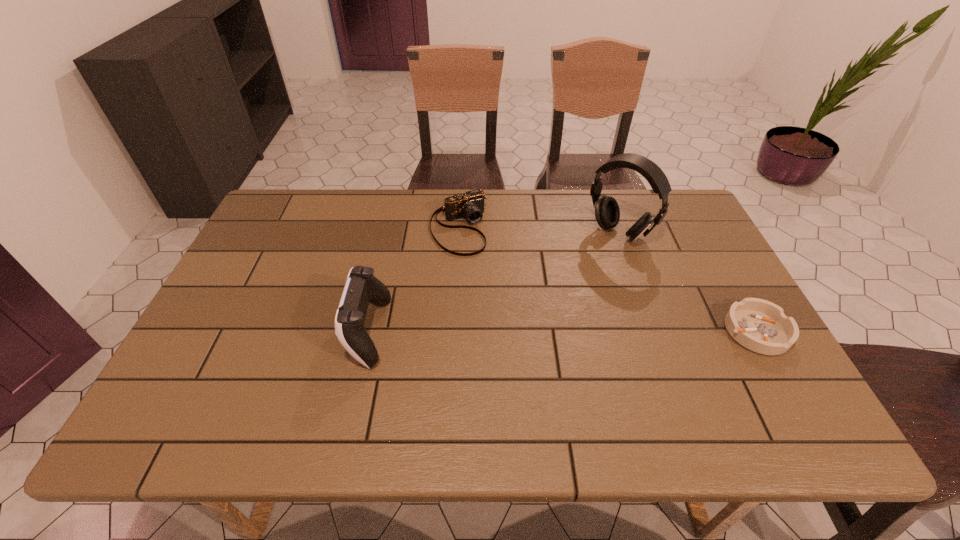
Where is `vacant area located on the front-facing side of the leftmost object`? The height and width of the screenshot is (540, 960). vacant area located on the front-facing side of the leftmost object is located at coordinates (283, 332).

I want to click on free region located on the back of the ashtray, so click(733, 291).

This screenshot has width=960, height=540. Identify the location of vacant space located 0.300m on the ear cups of the tallest object. (542, 305).

Where is `blank space located 0.250m on the ear cups of the tallest object`? The height and width of the screenshot is (540, 960). blank space located 0.250m on the ear cups of the tallest object is located at coordinates (554, 294).

This screenshot has height=540, width=960. Identify the location of vacant area situated on the ear cups of the tallest object. (580, 269).

Find the location of `vacant space located 0.180m on the front-facing side of the third tallest object`. vacant space located 0.180m on the front-facing side of the third tallest object is located at coordinates (492, 296).

Locate an element on the screen. free space located 0.210m on the front-facing side of the third tallest object is located at coordinates (497, 304).

Find the location of `free region located on the front-facing side of the third tallest object`. free region located on the front-facing side of the third tallest object is located at coordinates (497, 304).

I want to click on earphone present at the far edge, so click(x=607, y=213).

Find the location of a particular element. This screenshot has height=540, width=960. camera located at the far edge is located at coordinates (470, 205).